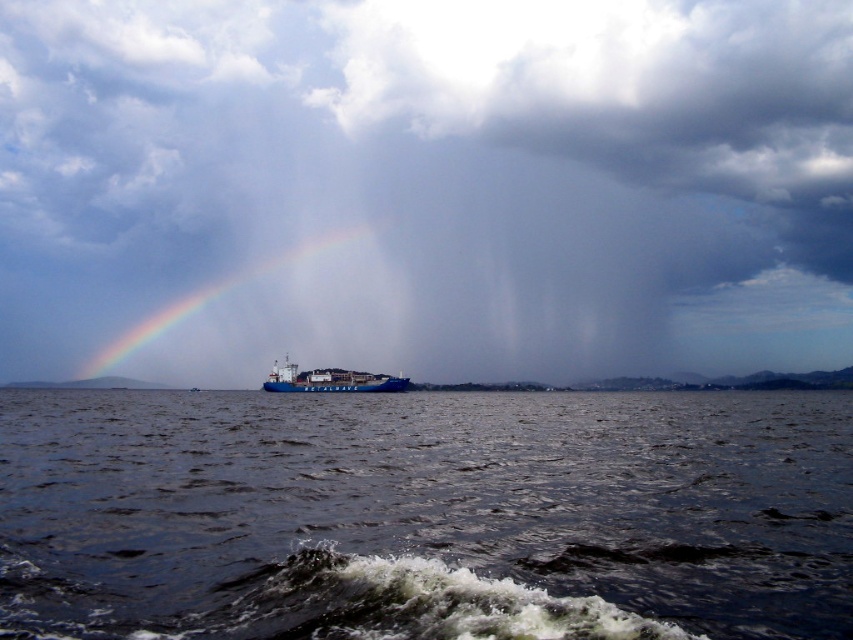
You are a sailor on the METALNAVE ship and need to navigate through the storm. There is a point marked at coordinates (425, 515) on your nautical map. According to the image, what does this point represent?

The point at coordinates (425, 515) marks dark blue water at center, so it represents the location of the dark blue water at center in the stormy sea.

You are a sailor on the METALNAVE ship and you notice two elements in the sky and water. Which one is positioned to the left when looking at the cloudy textured sky at center and dark blue water at center?

The cloudy textured sky at center is positioned to the left of the dark blue water at center according to the description.